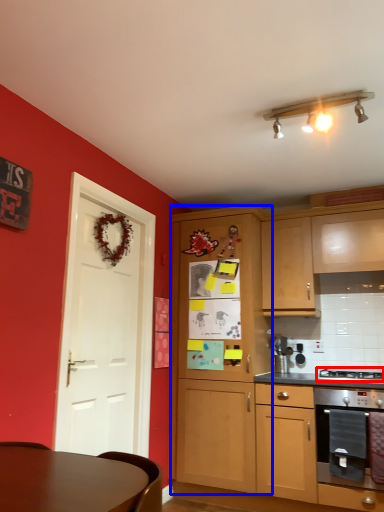
Question: Which of the following is the closest to the observer, gas stove (highlighted by a red box) or cabinetry (highlighted by a blue box)?

Choices:
 (A) gas stove
 (B) cabinetry

Answer: (A)